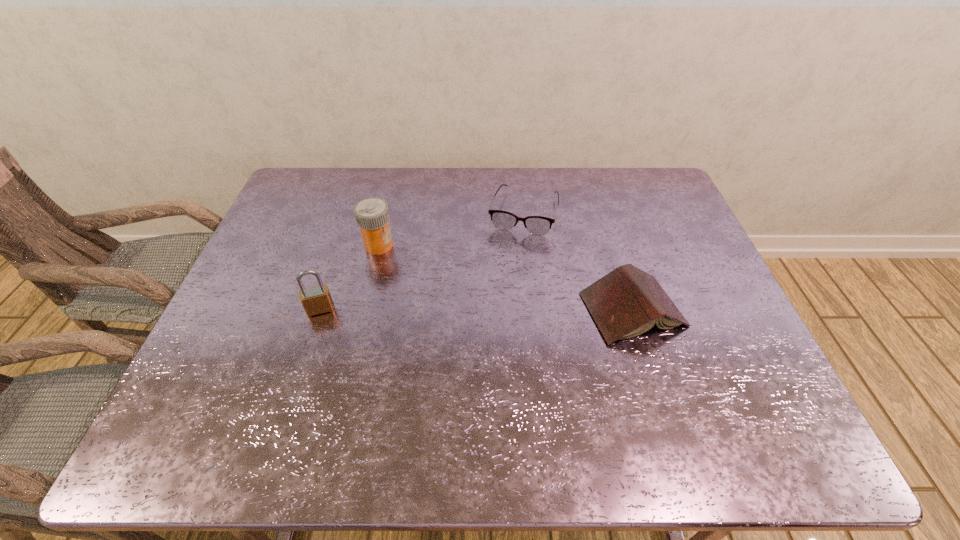
Locate an element on the screen. This screenshot has width=960, height=540. the leftmost object is located at coordinates (315, 300).

Where is `the rightmost object`? the rightmost object is located at coordinates (627, 302).

Identify the location of medicine. This screenshot has height=540, width=960. (372, 215).

At what (x,y) coordinates should I click in order to perform the action: click on the second object from right to left. Please return your answer as a coordinate pair (x, y). This screenshot has height=540, width=960. Looking at the image, I should click on (538, 225).

Locate an element on the screen. The image size is (960, 540). blank space located on the left of the padlock is located at coordinates (275, 309).

Identify the location of vacant position located on the left of the rightmost object. (499, 310).

Where is `vacant position located on the label side of the second object from left to right`? The image size is (960, 540). vacant position located on the label side of the second object from left to right is located at coordinates pyautogui.click(x=412, y=269).

At what (x,y) coordinates should I click in order to perform the action: click on vacant area located 0.240m on the label side of the second object from left to right. Please return your answer as a coordinate pair (x, y). This screenshot has height=540, width=960. Looking at the image, I should click on (447, 295).

Find the location of `vacant region located 0.090m on the label side of the second object from left to right`. vacant region located 0.090m on the label side of the second object from left to right is located at coordinates (409, 267).

Find the location of `vacant area situated 0.210m on the face of the third object from left to right`. vacant area situated 0.210m on the face of the third object from left to right is located at coordinates pyautogui.click(x=503, y=287).